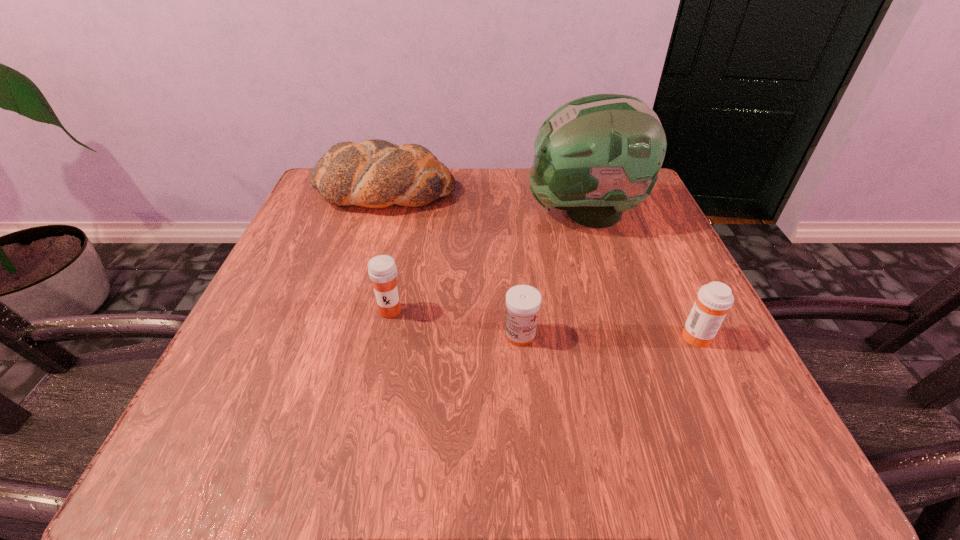
Where is `object located in the far right corner section of the desktop`? This screenshot has width=960, height=540. object located in the far right corner section of the desktop is located at coordinates (596, 156).

Locate an element on the screen. free space at the far edge is located at coordinates (471, 211).

Where is `free region at the left edge of the desktop`? This screenshot has height=540, width=960. free region at the left edge of the desktop is located at coordinates tap(317, 325).

Identify the location of vacant space at the near left corner of the desktop. (198, 421).

You are a GUI agent. You are given a task and a screenshot of the screen. Output one action in this format:
    pyautogui.click(x=<x>, y=<y>)
    Task: Click on the free region at the far right corner of the desktop
    
    Given the screenshot: What is the action you would take?
    pyautogui.click(x=662, y=222)

Locate an element on the screen. The width and height of the screenshot is (960, 540). empty location between the tallest object and the third nearest object is located at coordinates 488,262.

Locate an element on the screen. vacant region between the third object from right to left and the farthest medicine is located at coordinates (455, 323).

Identify the location of free space between the farthest medicine and the rightmost medicine. This screenshot has height=540, width=960. (543, 323).

Locate an element on the screen. empty location between the shortest medicine and the rightmost medicine is located at coordinates pyautogui.click(x=608, y=335).

The height and width of the screenshot is (540, 960). Find the location of `blank region between the football helmet and the third object from right to left`. blank region between the football helmet and the third object from right to left is located at coordinates (552, 274).